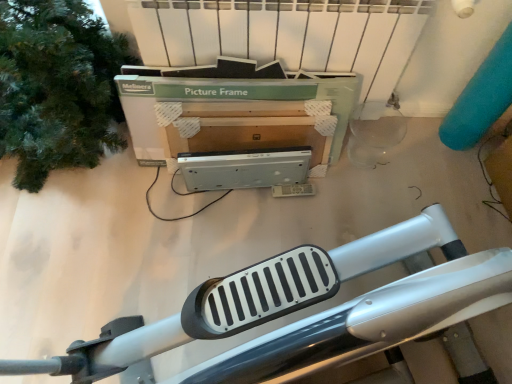
Locate an element on the screen. The width and height of the screenshot is (512, 384). green cardboard picture frame at upper center is located at coordinates (248, 109).

Where is `silver metallic exercise machine at lower center`? The image size is (512, 384). silver metallic exercise machine at lower center is located at coordinates (303, 307).

The image size is (512, 384). Identify the location of green cardboard picture frame at upper center. (248, 109).

Is green matte tree at left beside green cardboard picture frame at upper center?

No, green matte tree at left is not next to green cardboard picture frame at upper center.

At what (x,y) coordinates should I click in order to perform the action: click on box on the right side of green matte tree at left. Please return your answer as a coordinate pair (x, y). The width and height of the screenshot is (512, 384). Looking at the image, I should click on [x=248, y=109].

In the image, is green matte tree at left on the left side or the right side of green cardboard picture frame at upper center?

Based on their positions, green matte tree at left is located to the left of green cardboard picture frame at upper center.

From a real-world perspective, relative to green matte tree at left, is green cardboard picture frame at upper center vertically above or below?

Clearly, from a real-world perspective, green cardboard picture frame at upper center is below green matte tree at left.

Considering the sizes of green cardboard picture frame at upper center and green matte tree at left in the image, is green cardboard picture frame at upper center bigger or smaller than green matte tree at left?

green cardboard picture frame at upper center is smaller than green matte tree at left.

Which is nearer, (303,92) or (32,73)?

Point (303,92) is positioned farther from the camera compared to point (32,73).

Is green matte tree at left at the back of green cardboard picture frame at upper center?

No, green matte tree at left is not at the back of green cardboard picture frame at upper center.

From a real-world perspective, is green cardboard picture frame at upper center above or below silver metallic exercise machine at lower center?

green cardboard picture frame at upper center is situated higher than silver metallic exercise machine at lower center in the real world.

Is green cardboard picture frame at upper center facing away from silver metallic exercise machine at lower center?

No, green cardboard picture frame at upper center is not facing away from silver metallic exercise machine at lower center.

Identify the location of box above the silver metallic exercise machine at lower center (from a real-world perspective). The image size is (512, 384). (248, 109).

Which is less distant, (x=217, y=70) or (x=259, y=291)?

Point (x=217, y=70) is farther from the camera than point (x=259, y=291).

From a real-world perspective, is silver metallic exercise machine at lower center positioned above or below green matte tree at left?

Clearly, from a real-world perspective, silver metallic exercise machine at lower center is below green matte tree at left.

Based on their sizes in the image, would you say silver metallic exercise machine at lower center is bigger or smaller than green matte tree at left?

In the image, silver metallic exercise machine at lower center appears to be smaller than green matte tree at left.

Is silver metallic exercise machine at lower center not inside green matte tree at left?

Yes, silver metallic exercise machine at lower center is outside of green matte tree at left.

Does silver metallic exercise machine at lower center appear on the right side of green matte tree at left?

Yes, silver metallic exercise machine at lower center is to the right of green matte tree at left.

Is point (256, 343) less distant than point (269, 124)?

Yes, it is.

Can you tell me how much silver metallic exercise machine at lower center and green cardboard picture frame at upper center differ in facing direction?

The angle between the facing direction of silver metallic exercise machine at lower center and the facing direction of green cardboard picture frame at upper center is 0.403 degrees.

Is silver metallic exercise machine at lower center at the right side of green cardboard picture frame at upper center?

Yes.

Locate an element on the screen. This screenshot has width=512, height=384. box above the silver metallic exercise machine at lower center (from a real-world perspective) is located at coordinates (248, 109).

Which is more to the left, green matte tree at left or silver metallic exercise machine at lower center?

green matte tree at left is more to the left.

From a real-world perspective, is green matte tree at left over silver metallic exercise machine at lower center?

Yes.

Can you confirm if green matte tree at left is smaller than silver metallic exercise machine at lower center?

No, green matte tree at left is not smaller than silver metallic exercise machine at lower center.

Locate an element on the screen. The image size is (512, 384). tree lying in front of the green cardboard picture frame at upper center is located at coordinates (57, 87).

Find the location of a particular element. This screenshot has height=384, width=512. box below the green matte tree at left (from a real-world perspective) is located at coordinates (248, 109).

Based on their spatial positions, is silver metallic exercise machine at lower center or green matte tree at left closer to green cardboard picture frame at upper center?

Based on the image, green matte tree at left appears to be nearer to green cardboard picture frame at upper center.

Which object lies nearer to the anchor point green matte tree at left, silver metallic exercise machine at lower center or green cardboard picture frame at upper center?

green cardboard picture frame at upper center.

From the image, which object appears to be farther from silver metallic exercise machine at lower center, green cardboard picture frame at upper center or green matte tree at left?

Among the two, green matte tree at left is located further to silver metallic exercise machine at lower center.

Which object lies further to the anchor point silver metallic exercise machine at lower center, green matte tree at left or green cardboard picture frame at upper center?

Among the two, green matte tree at left is located further to silver metallic exercise machine at lower center.

Considering their positions, is green matte tree at left positioned further to green cardboard picture frame at upper center than silver metallic exercise machine at lower center?

silver metallic exercise machine at lower center lies further to green cardboard picture frame at upper center than the other object.

From the image, which object appears to be farther from green matte tree at left, green cardboard picture frame at upper center or silver metallic exercise machine at lower center?

Result: Based on the image, silver metallic exercise machine at lower center appears to be further to green matte tree at left.

The width and height of the screenshot is (512, 384). I want to click on box situated between green matte tree at left and silver metallic exercise machine at lower center from left to right, so click(248, 109).